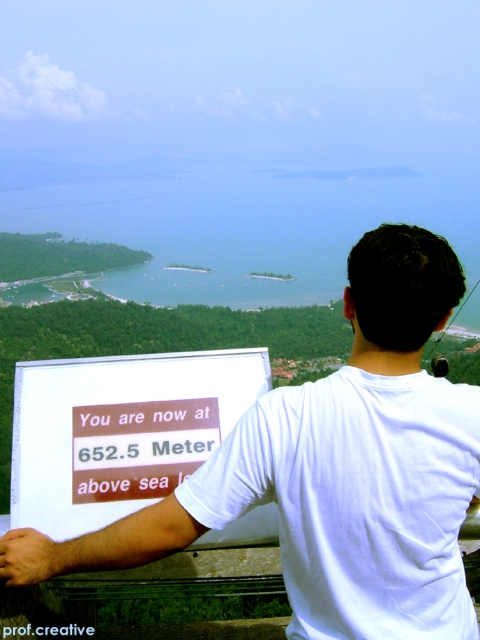
Question: Which of the following is the closest to the observer?

Choices:
 (A) (156, 556)
 (B) (132, 381)
 (C) (432, 406)

Answer: (C)

Question: Which object is the closest to the white paper sign at center?

Choices:
 (A) white cotton shirt at center
 (B) white cotton t-shirt at upper center

Answer: (B)

Question: Does white cotton t-shirt at upper center have a larger size compared to white paper sign at center?

Choices:
 (A) yes
 (B) no

Answer: (B)

Question: Which point is closer to the camera taking this photo?

Choices:
 (A) (190, 365)
 (B) (403, 392)
 (C) (327, 563)

Answer: (B)

Question: Is the position of white cotton t-shirt at upper center more distant than that of white paper sign at center?

Choices:
 (A) no
 (B) yes

Answer: (A)

Question: Is the position of white cotton shirt at center more distant than that of white paper sign at center?

Choices:
 (A) no
 (B) yes

Answer: (A)